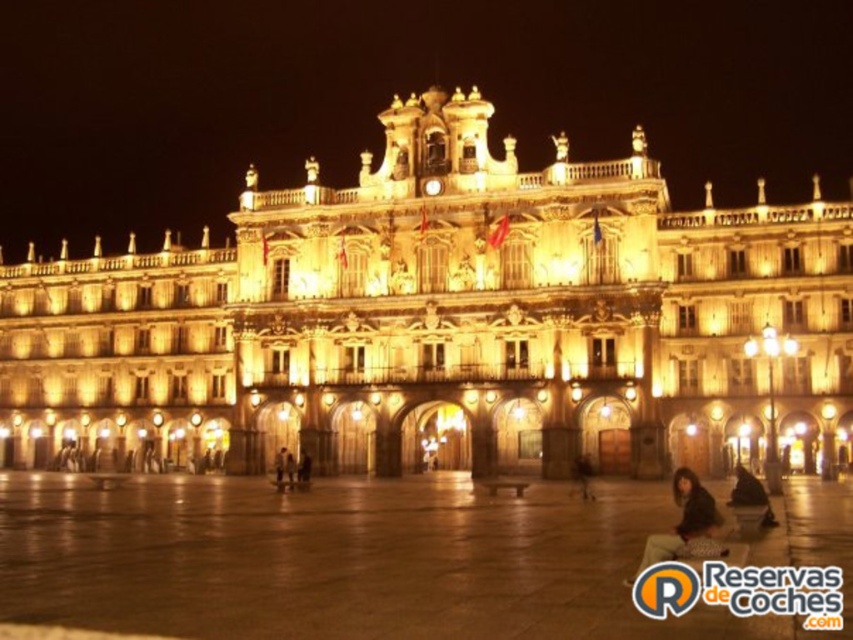
Who is more distant from viewer, (718, 547) or (735, 474)?

The point (735, 474) is behind.

Between point (698, 516) and point (749, 476), which one is positioned in front?

Point (698, 516)

Is point (662, 541) closer to viewer compared to point (740, 477)?

That is True.

At what (x,y) coordinates should I click in order to perform the action: click on dark brown hair at lower right. Please return your answer as a coordinate pair (x, y). Image resolution: width=853 pixels, height=640 pixels. Looking at the image, I should click on (685, 524).

Does golden stone building at center appear on the right side of dark brown hair at lower right?

Incorrect, golden stone building at center is not on the right side of dark brown hair at lower right.

Does golden stone building at center appear over dark brown hair at lower right?

Correct, golden stone building at center is located above dark brown hair at lower right.

The image size is (853, 640). Find the location of `golden stone building at center`. golden stone building at center is located at coordinates (444, 323).

This screenshot has height=640, width=853. Identify the location of golden stone building at center. pos(444,323).

Describe the element at coordinates (444, 323) in the screenshot. I see `golden stone building at center` at that location.

Does point (531, 417) lie in front of point (746, 483)?

No, it is behind (746, 483).

You are a GUI agent. You are given a task and a screenshot of the screen. Output one action in this format:
    pyautogui.click(x=<x>, y=<y>)
    Task: Click on the golden stone building at center
    This screenshot has width=853, height=640.
    Given the screenshot: What is the action you would take?
    pyautogui.click(x=444, y=323)